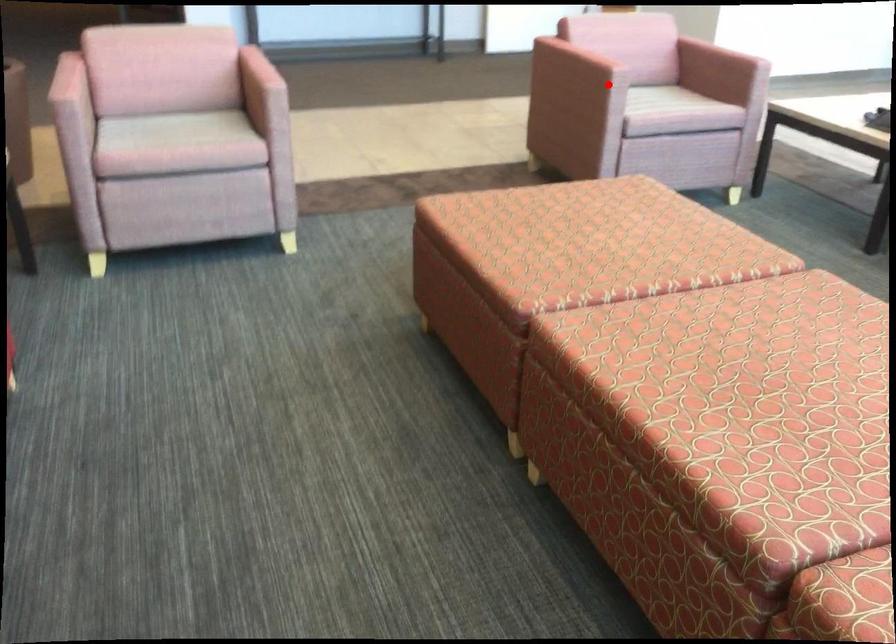
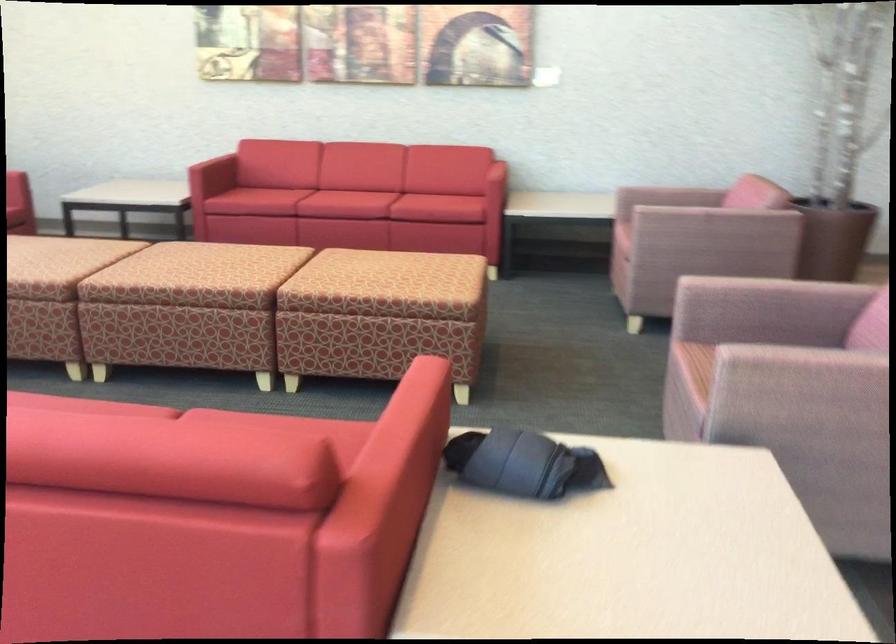
Find the pixel in the second image that matches the highlighted location in the first image.

(760, 330)